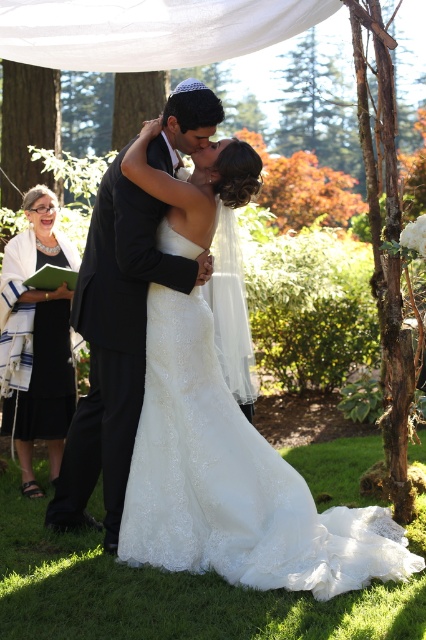
You are a photographer at the wedding and need to adjust the lighting. The black satin suit at center and the black dress at left are both in the frame. Which one is taller?

The black satin suit at center is taller than the black dress at left.

You are a photographer at the wedding and need to ensure both the white lace dress at center and the black satin suit at center are fully visible in the photo. Given their sizes, which one might require more space in the frame?

The white lace dress at center is bigger than the black satin suit at center, so it requires more space in the frame to be fully visible.